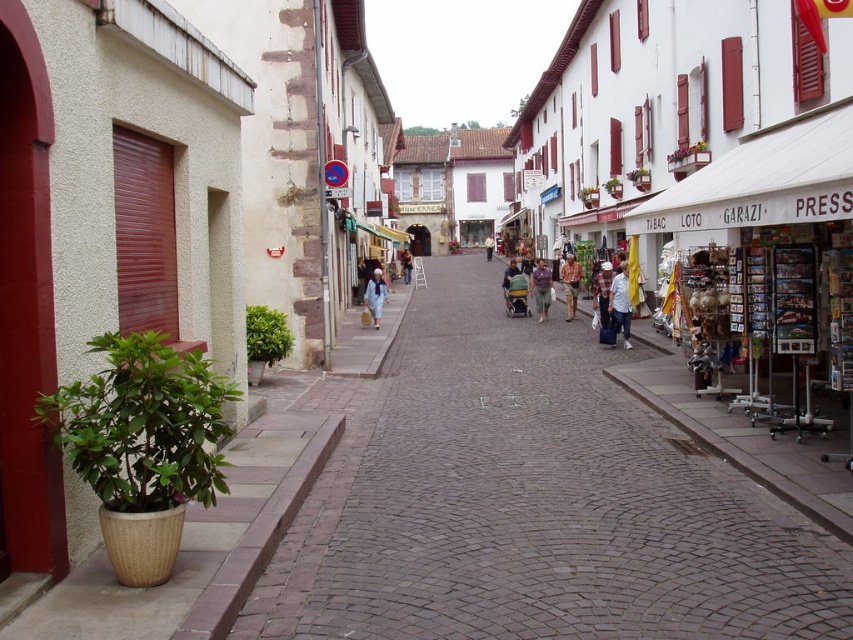
Does plaid shirt at center appear on the left side of khaki cotton shorts at center?

Correct, you'll find plaid shirt at center to the left of khaki cotton shorts at center.

Is plaid shirt at center closer to camera compared to khaki cotton shorts at center?

Yes, plaid shirt at center is in front of khaki cotton shorts at center.

Who is more distant from viewer, (604, 301) or (564, 262)?

The point (564, 262) is behind.

Where is `plaid shirt at center`? plaid shirt at center is located at coordinates (602, 292).

Locate an element on the screen. light blue denim jeans at center is located at coordinates (619, 305).

Does light blue denim jeans at center appear over light blue fabric jacket at center?

→ Actually, light blue denim jeans at center is below light blue fabric jacket at center.

Between point (627, 266) and point (544, 301), which one is positioned behind?

The point (544, 301) is behind.

In order to click on light blue denim jeans at center in this screenshot , I will do `click(619, 305)`.

Who is more forward, [598,268] or [378,273]?

Point [598,268] is more forward.

Is point (608, 291) positioned in front of point (380, 269)?

Yes, point (608, 291) is closer to viewer.

Is point (601, 317) positioned after point (376, 289)?

No, it is in front of (376, 289).

Locate an element on the screen. plaid shirt at center is located at coordinates (602, 292).